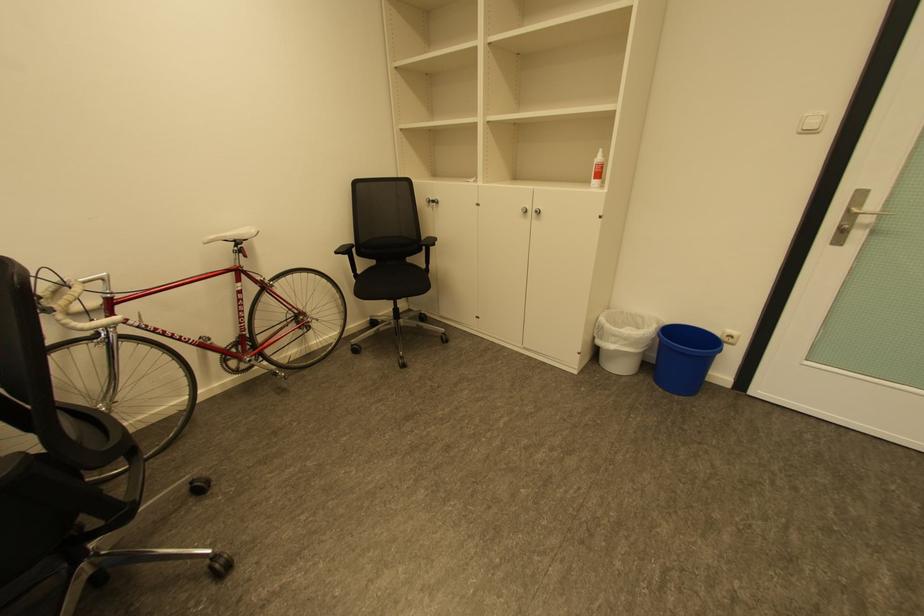
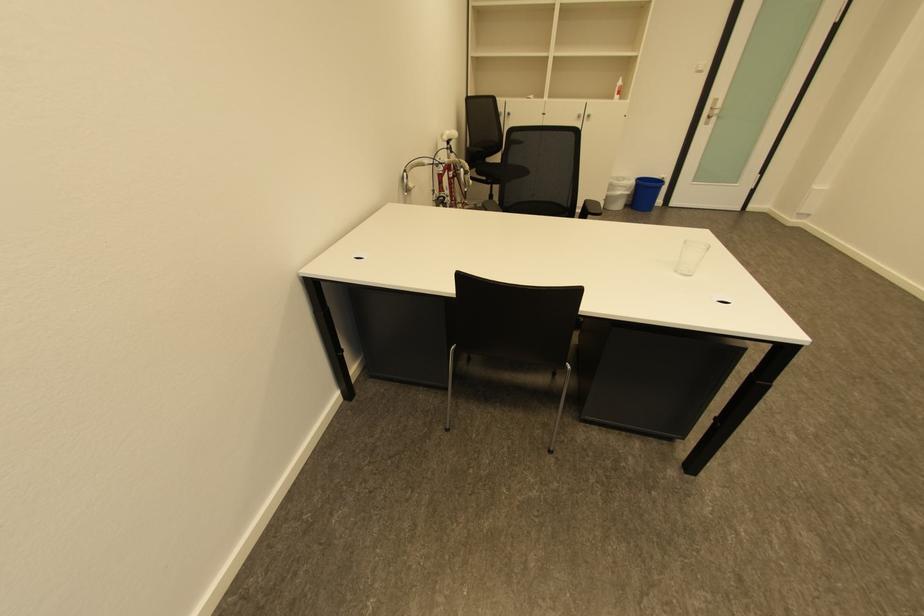
Where in the second image is the point corresponding to pixel 622 337 from the first image?

(626, 188)